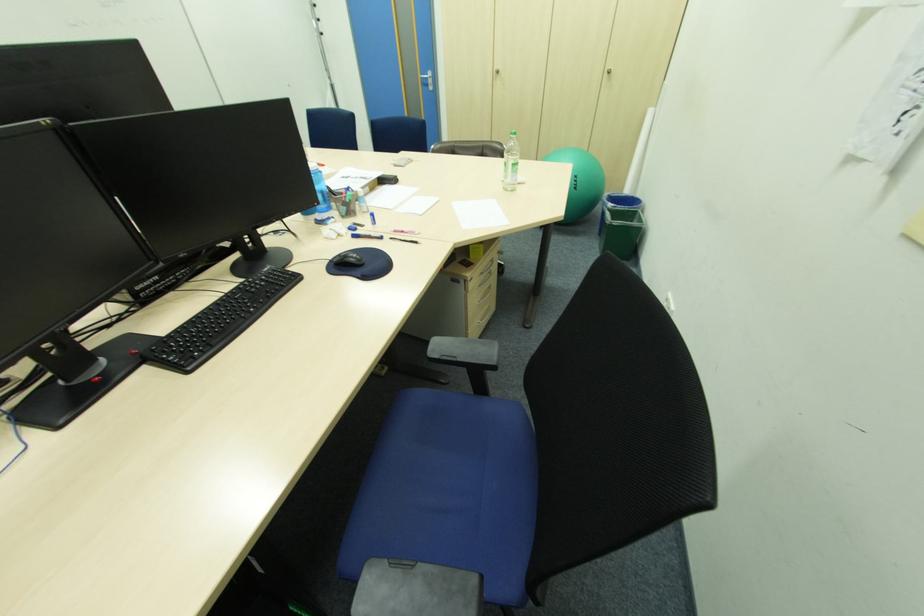
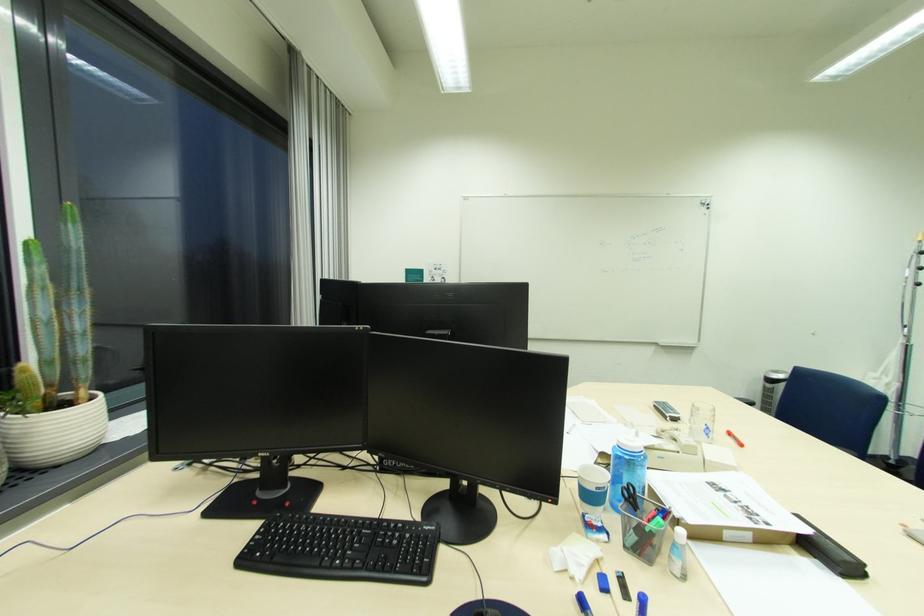
Where in the second image is the point corresponding to (x=266, y=286) from the first image?

(396, 541)